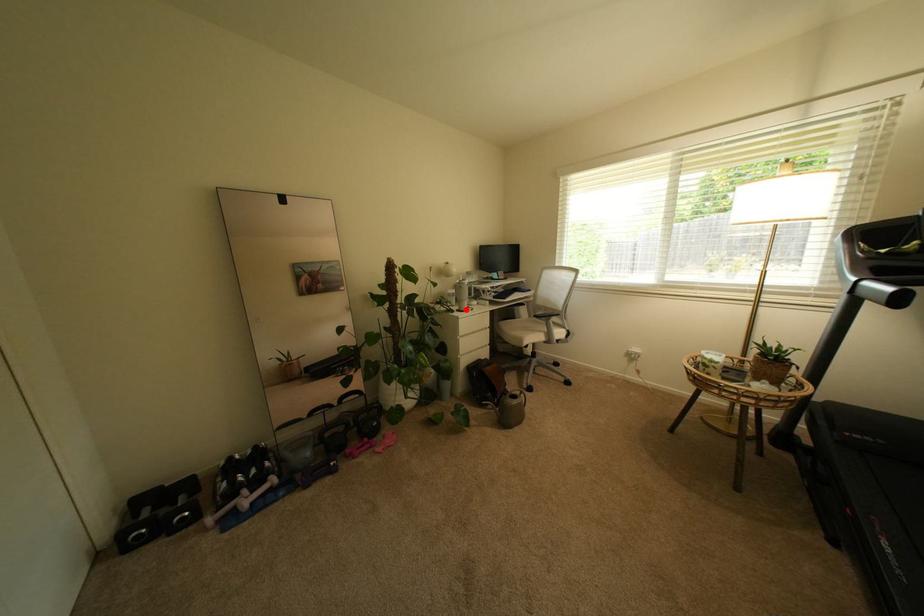
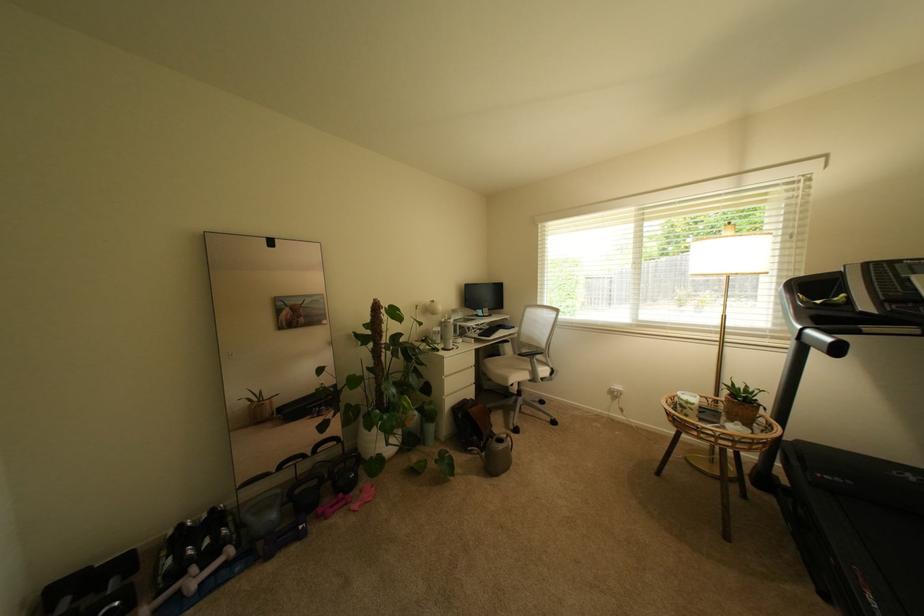
Find the pixel in the second image that matches the highlighted location in the first image.

(451, 347)